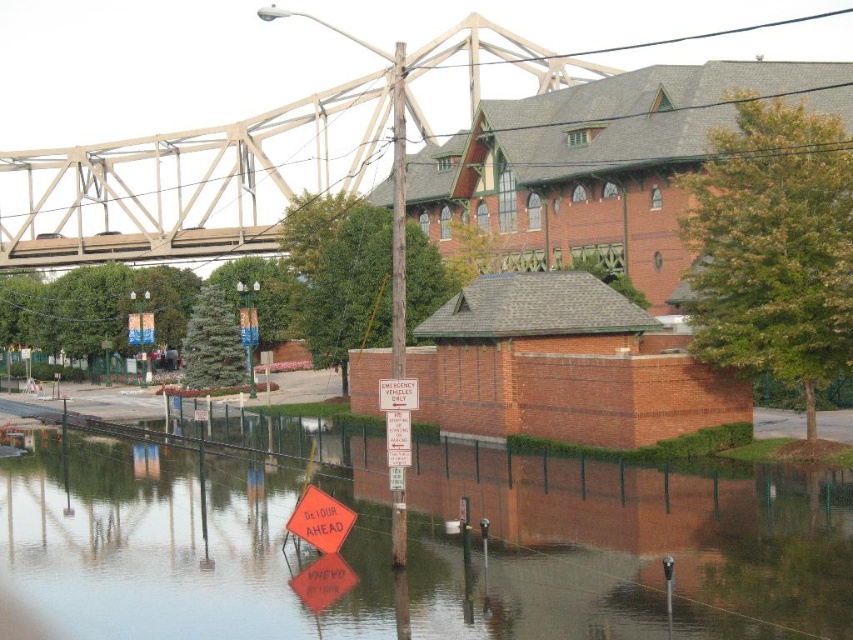
Can you confirm if translucent plastic water at lower center is positioned below metallic gray bridge at upper center?

Yes.

Is translucent plastic water at lower center shorter than metallic gray bridge at upper center?

Correct, translucent plastic water at lower center is not as tall as metallic gray bridge at upper center.

Does point (583, 488) come in front of point (90, 260)?

Yes.

Locate an element on the screen. This screenshot has width=853, height=640. translucent plastic water at lower center is located at coordinates (422, 545).